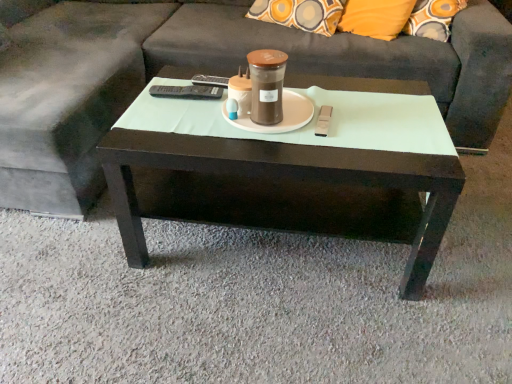
Locate an element on the screen. This screenshot has height=384, width=512. vacant space situated above dark wood coffee table at center (from a real-world perspective) is located at coordinates (276, 127).